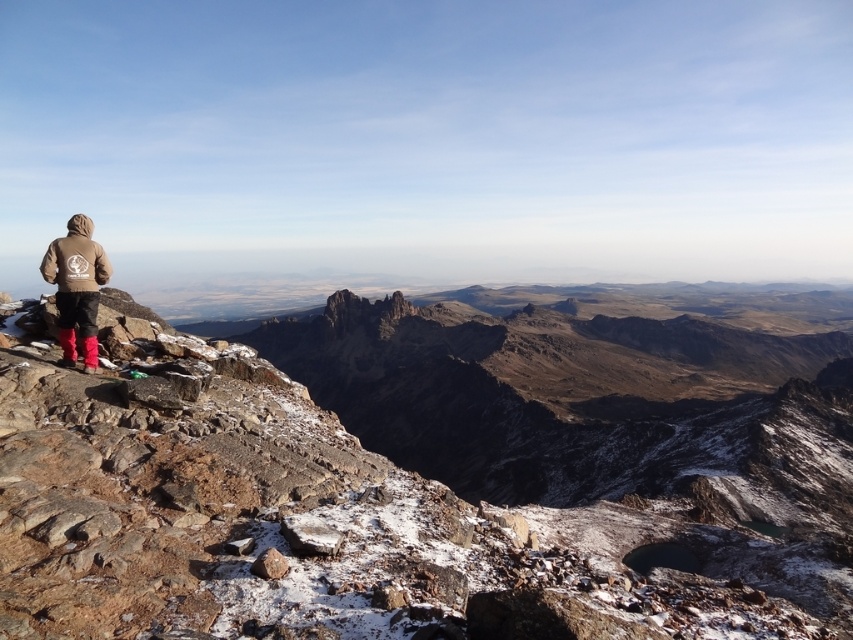
Which is behind, point (646, 536) or point (73, 356)?

Positioned behind is point (646, 536).

Between point (428, 586) and point (84, 300), which one is positioned in front?

Point (428, 586) is more forward.

Where is `brown rocky mountain at left`? This screenshot has height=640, width=853. brown rocky mountain at left is located at coordinates (434, 472).